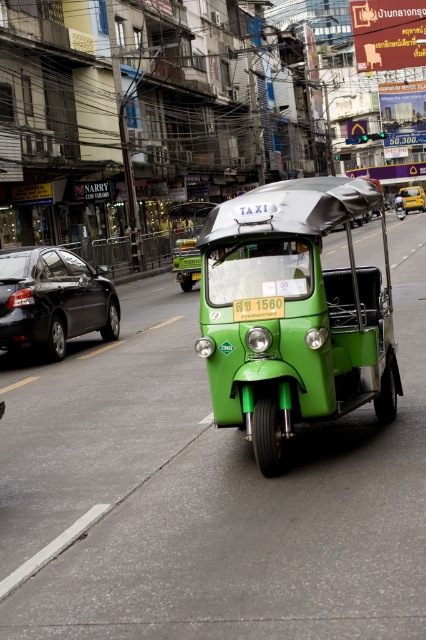
Question: Considering the relative positions of shiny black sedan at left and green matte taxi at center in the image provided, where is shiny black sedan at left located with respect to green matte taxi at center?

Choices:
 (A) below
 (B) above

Answer: (A)

Question: Does shiny black sedan at left appear on the left side of green matte taxi at center?

Choices:
 (A) yes
 (B) no

Answer: (A)

Question: Which object is closer to the camera taking this photo?

Choices:
 (A) shiny black sedan at left
 (B) green plastic license plate at center
 (C) green matte taxi at center

Answer: (B)

Question: Which of the following is the farthest from the observer?

Choices:
 (A) click(x=278, y=308)
 (B) click(x=42, y=284)
 (C) click(x=414, y=186)

Answer: (C)

Question: Is shiny black sedan at left thinner than green plastic license plate at center?

Choices:
 (A) no
 (B) yes

Answer: (A)

Question: Which object appears farthest from the camera in this image?

Choices:
 (A) green matte taxi at center
 (B) green plastic license plate at center
 (C) shiny black sedan at left

Answer: (A)